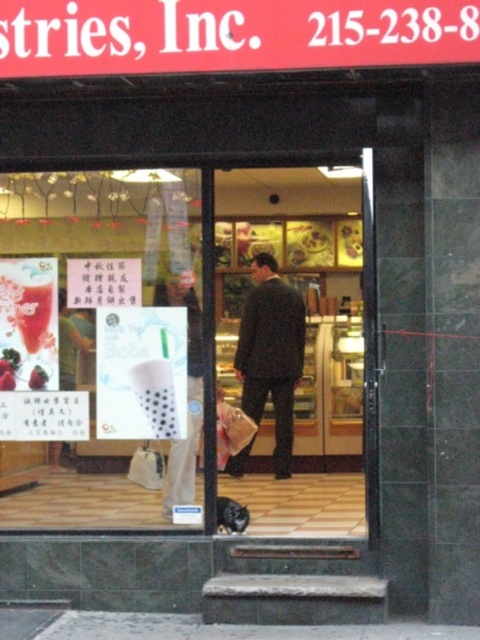
Question: Estimate the real-world distances between objects in this image. Which object is closer to the matte plastic bag at center?

Choices:
 (A) smooth matte strawberry at lower left
 (B) dark wool suit at center
 (C) transparent plastic sign at center

Answer: (C)

Question: Based on their relative distances, which object is nearer to the white fabric shopping bag at lower center?

Choices:
 (A) dark wool suit at center
 (B) smooth matte strawberry at lower left
 (C) transparent plastic sign at center

Answer: (B)

Question: Can you confirm if dark wool suit at center is positioned to the right of smooth matte strawberry at lower left?

Choices:
 (A) no
 (B) yes

Answer: (B)

Question: Does transparent plastic sign at center appear on the left side of white fabric shopping bag at lower center?

Choices:
 (A) yes
 (B) no

Answer: (A)

Question: Can you confirm if matte plastic bag at center is positioned below smooth matte strawberry at lower left?

Choices:
 (A) no
 (B) yes

Answer: (B)

Question: Which object appears closest to the camera in this image?

Choices:
 (A) smooth matte strawberry at lower left
 (B) matte plastic bag at center

Answer: (B)